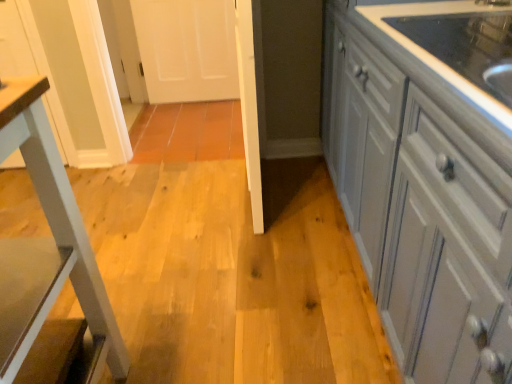
Question: Is white glossy cabinets at right to the left of white glossy table leg at left from the viewer's perspective?

Choices:
 (A) no
 (B) yes

Answer: (A)

Question: From a real-world perspective, is white glossy cabinets at right beneath white glossy table leg at left?

Choices:
 (A) yes
 (B) no

Answer: (A)

Question: Is white glossy cabinets at right taller than white glossy table leg at left?

Choices:
 (A) yes
 (B) no

Answer: (A)

Question: Could white glossy table leg at left be considered to be inside white glossy cabinets at right?

Choices:
 (A) yes
 (B) no

Answer: (B)

Question: Is white glossy cabinets at right aimed at white glossy table leg at left?

Choices:
 (A) no
 (B) yes

Answer: (B)

Question: From the image's perspective, is white glossy cabinets at right beneath white glossy table leg at left?

Choices:
 (A) yes
 (B) no

Answer: (B)

Question: Could you tell me if white glossy table leg at left is turned towards white glossy cabinets at right?

Choices:
 (A) yes
 (B) no

Answer: (B)

Question: Can you confirm if white glossy table leg at left is thinner than white glossy cabinets at right?

Choices:
 (A) no
 (B) yes

Answer: (B)

Question: From the image's perspective, is white glossy table leg at left located beneath white glossy cabinets at right?

Choices:
 (A) no
 (B) yes

Answer: (B)

Question: Is white glossy table leg at left taller than white glossy cabinets at right?

Choices:
 (A) yes
 (B) no

Answer: (B)

Question: Can we say white glossy table leg at left lies outside white glossy cabinets at right?

Choices:
 (A) no
 (B) yes

Answer: (B)

Question: Considering the relative positions of white glossy table leg at left and white glossy cabinets at right in the image provided, is white glossy table leg at left to the right of white glossy cabinets at right from the viewer's perspective?

Choices:
 (A) yes
 (B) no

Answer: (B)

Question: In terms of height, does white glossy table leg at left look taller or shorter compared to white glossy cabinets at right?

Choices:
 (A) tall
 (B) short

Answer: (B)